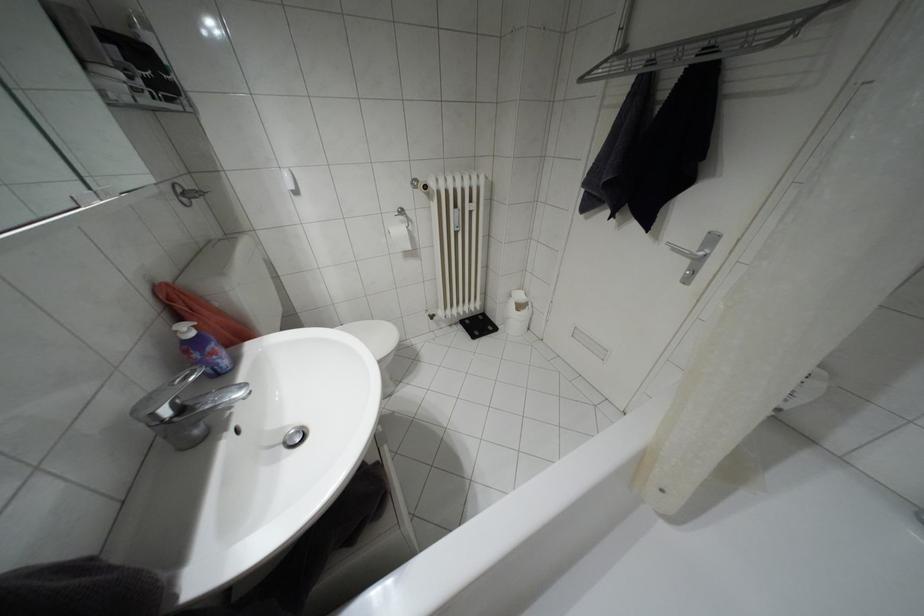
Where would you lift the black digital scale? Please return your answer as a coordinate pair (x, y).

(478, 325)